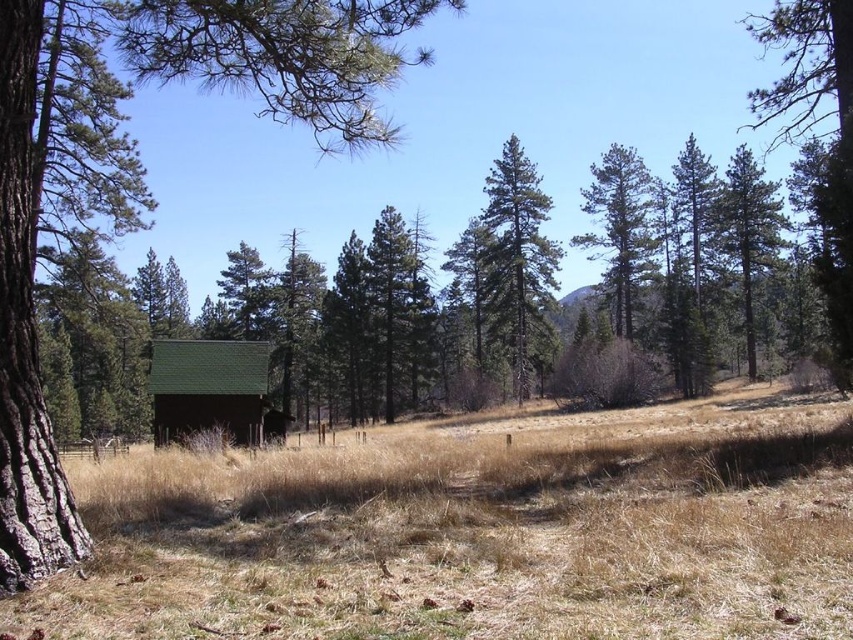
Question: Estimate the real-world distances between objects in this image. Which object is farther from the green shingled cabin at lower left?

Choices:
 (A) smooth bark tree at left
 (B) green textured pine tree at center
 (C) green pine tree at upper right

Answer: (C)

Question: Is brown dry grass at center behind green shingled cabin at lower left?

Choices:
 (A) no
 (B) yes

Answer: (A)

Question: Which point appears farthest from the camera in this image?

Choices:
 (A) (521, 202)
 (B) (747, 192)

Answer: (A)

Question: Is smooth bark tree at left positioned before green pine tree at upper right?

Choices:
 (A) no
 (B) yes

Answer: (B)

Question: Which object is positioned farthest from the brown dry grass at center?

Choices:
 (A) smooth bark tree at left
 (B) green pine tree at upper right
 (C) green shingled cabin at lower left
 (D) green textured pine tree at center

Answer: (B)

Question: Does brown dry grass at center have a larger size compared to smooth bark tree at left?

Choices:
 (A) yes
 (B) no

Answer: (B)